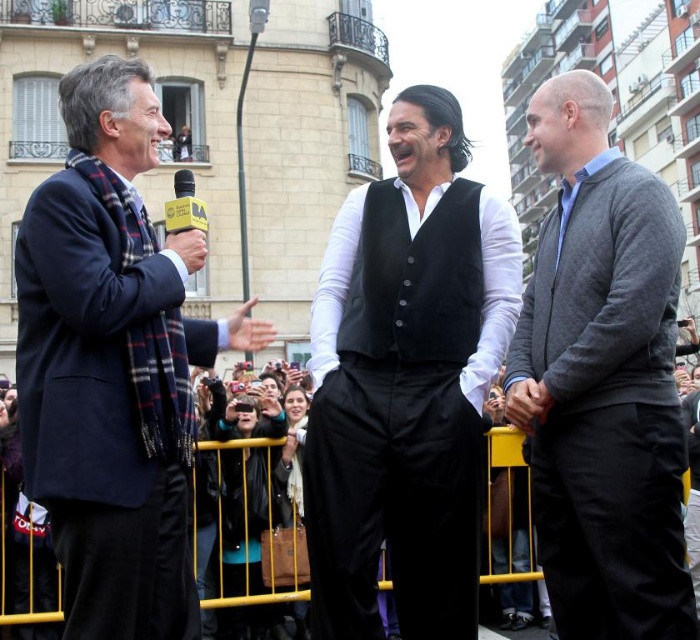
You are a fashion designer observing the three men in the scene. You need to determine which clothing item, the gray wool sweater at right or the black matte vest at center, would require more fabric to produce. Based on the description, which one would need more material?

The gray wool sweater at right has a larger size compared to the black matte vest at center, so it would require more fabric to produce.

You are a photographer positioned at the center of the scene. You need to take a photo that includes both the matte black coat at left and the central figure wearing a black vest over a white. Which direction should you move to ensure both subjects are in frame?

Since the matte black coat at left is located at point (113, 364) and the central figure is in the middle, moving slightly to the left would keep both subjects within the frame while maintaining their positions relative to each other.

What are the coordinates of the gray wool sweater at right in the image?

The gray wool sweater at right is located at coordinates (x=602, y=380).